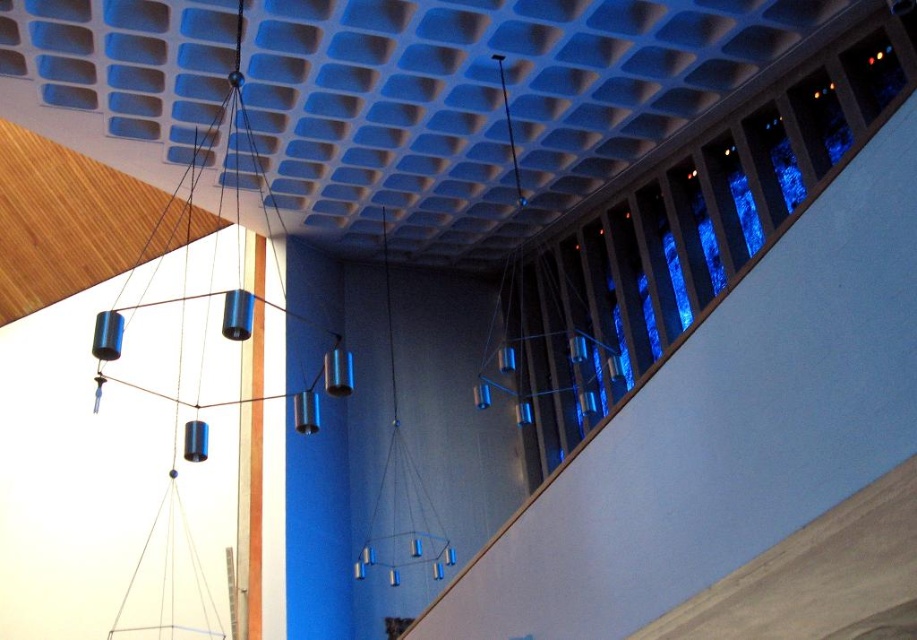
You are an interior designer planning to install a new fixture between the metallic blue hanging light at center and the metallic cylinders at upper right. The new fixture requires a minimum of 3 meters of space between it and any existing fixtures. Based on the current spacing, will there be enough room for the new fixture?

The metallic blue hanging light at center is 3.31 meters from the metallic cylinders at upper right. Since the required minimum space is 3 meters, there is enough room to install the new fixture between them.

Based on the photo, you are an interior designer planning to install a new fixture in this space. You have a choice between two options. The first is a large chandelier that requires 1.5 meters of horizontal space. The second is a smaller pendant light needing only 0.8 meters. Based on the current setup with the metallic blue hanging light at center and the metallic cylinders at upper right, which fixture would fit better without obstructing the walkway below?

The metallic blue hanging light at center might be wider than the metallic cylinders at upper right. Since the chandelier requires 1.5 meters and the pendant light needs 0.8 meters, the pendant light is more likely to fit without obstruction because the metallic cylinders at upper right are narrower. However, if the metallic blue hanging light at center is indeed wider than 1.5 meters, neither might fit. Consult exact measurements for confirmation.

You are standing in the room and want to touch the metallic blue hanging light at center. If you can reach up to 2 meters, can you touch it?

The metallic blue hanging light at center is 10.31 meters away from you, which is much higher than your reach of 2 meters. You cannot touch it.